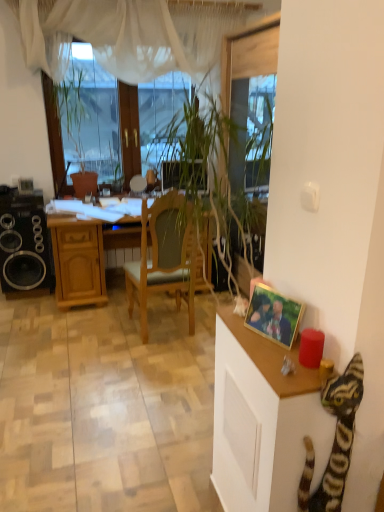
Question: Is gold-framed photo at right in front of wooden desk at center?

Choices:
 (A) yes
 (B) no

Answer: (A)

Question: From the image's perspective, is gold-framed photo at right over wooden desk at center?

Choices:
 (A) yes
 (B) no

Answer: (B)

Question: Can you confirm if gold-framed photo at right is taller than wooden desk at center?

Choices:
 (A) yes
 (B) no

Answer: (B)

Question: Does gold-framed photo at right appear on the right side of wooden desk at center?

Choices:
 (A) no
 (B) yes

Answer: (B)

Question: Is gold-framed photo at right smaller than wooden desk at center?

Choices:
 (A) no
 (B) yes

Answer: (B)

Question: In the image, is transparent glass window screen at upper left positioned in front of or behind wooden desk at center?

Choices:
 (A) behind
 (B) front

Answer: (A)

Question: Is transparent glass window screen at upper left to the left or to the right of wooden desk at center in the image?

Choices:
 (A) left
 (B) right

Answer: (A)

Question: Looking at their shapes, would you say transparent glass window screen at upper left is wider or thinner than wooden desk at center?

Choices:
 (A) wide
 (B) thin

Answer: (B)

Question: Is transparent glass window screen at upper left inside or outside of wooden desk at center?

Choices:
 (A) inside
 (B) outside

Answer: (B)

Question: Is point (208, 264) closer or farther from the camera than point (221, 324)?

Choices:
 (A) farther
 (B) closer

Answer: (A)

Question: From the image's perspective, relative to wooden cabinet at right, is wooden desk at center above or below?

Choices:
 (A) below
 (B) above

Answer: (B)

Question: Based on their sizes in the image, would you say wooden desk at center is bigger or smaller than wooden cabinet at right?

Choices:
 (A) small
 (B) big

Answer: (B)

Question: Visually, is wooden desk at center positioned to the left or to the right of wooden cabinet at right?

Choices:
 (A) left
 (B) right

Answer: (A)

Question: Considering the positions of gold-framed photo at right and wooden cabinet at right in the image, is gold-framed photo at right taller or shorter than wooden cabinet at right?

Choices:
 (A) tall
 (B) short

Answer: (B)

Question: Is point (273, 334) positioned closer to the camera than point (243, 435)?

Choices:
 (A) closer
 (B) farther

Answer: (A)